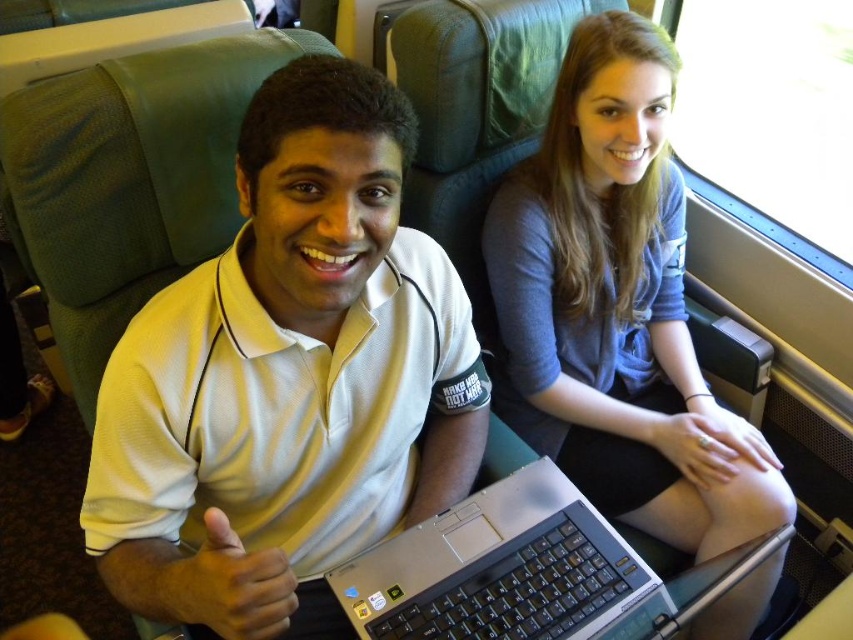
Is point (265, 320) positioned behind point (700, 566)?

No, it is in front of (700, 566).

Find the location of a particular element. white matte shirt at center is located at coordinates (287, 372).

Which is above, matte gray sweater at upper right or silver metallic laptop at center?

matte gray sweater at upper right is above.

From the picture: Does matte gray sweater at upper right come in front of silver metallic laptop at center?

No, it is not.

Is point (532, 211) closer to camera compared to point (524, 509)?

No, (532, 211) is behind (524, 509).

You are a GUI agent. You are given a task and a screenshot of the screen. Output one action in this format:
    pyautogui.click(x=<x>, y=<y>)
    Task: Click on the matte gray sweater at upper right
    
    Given the screenshot: What is the action you would take?
    pyautogui.click(x=618, y=307)

Who is positioned more to the right, white matte shirt at center or matte gray sweater at upper right?

matte gray sweater at upper right

This screenshot has width=853, height=640. What are the coordinates of `white matte shirt at center` in the screenshot? It's located at (287, 372).

Is point (357, 518) closer to camera compared to point (581, 48)?

Yes, point (357, 518) is closer to viewer.

Find the location of a particular element. The width and height of the screenshot is (853, 640). white matte shirt at center is located at coordinates (287, 372).